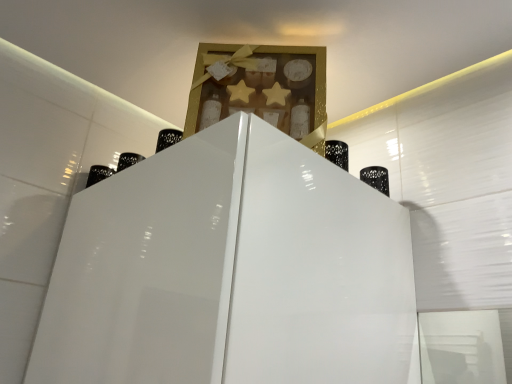
Image resolution: width=512 pixels, height=384 pixels. What do you see at coordinates (376, 178) in the screenshot? I see `black matte bottle at right` at bounding box center [376, 178].

This screenshot has width=512, height=384. Identify the location of black matte bottle at right. (376, 178).

The image size is (512, 384). Describe the element at coordinates (261, 88) in the screenshot. I see `gold textured box at upper center` at that location.

The image size is (512, 384). I want to click on gold textured box at upper center, so click(261, 88).

Image resolution: width=512 pixels, height=384 pixels. What are the coordinates of `black matte bottle at right` in the screenshot? It's located at (376, 178).

Considering the relative positions of gold textured box at upper center and black matte bottle at right in the image provided, is gold textured box at upper center to the left of black matte bottle at right from the viewer's perspective?

Indeed, gold textured box at upper center is positioned on the left side of black matte bottle at right.

Which object is further away from the camera, gold textured box at upper center or black matte bottle at right?

black matte bottle at right is more distant.

Does point (318, 53) come behind point (365, 177)?

No, it is in front of (365, 177).

From the image's perspective, who appears lower, gold textured box at upper center or black matte bottle at right?

black matte bottle at right, from the image's perspective.

From a real-world perspective, who is located higher, gold textured box at upper center or black matte bottle at right?

From a 3D spatial view, gold textured box at upper center is above.

Considering the sizes of objects gold textured box at upper center and black matte bottle at right in the image provided, who is wider, gold textured box at upper center or black matte bottle at right?

gold textured box at upper center is wider.

Based on the photo, is gold textured box at upper center shorter than black matte bottle at right?

No, gold textured box at upper center is not shorter than black matte bottle at right.

Who is smaller, gold textured box at upper center or black matte bottle at right?

Smaller between the two is black matte bottle at right.

From the picture: Is gold textured box at upper center completely or partially outside of black matte bottle at right?

Yes.

Is gold textured box at upper center with black matte bottle at right?

There is a gap between gold textured box at upper center and black matte bottle at right.

Does gold textured box at upper center turn towards black matte bottle at right?

No, gold textured box at upper center is not turned towards black matte bottle at right.

Can you tell me how much gold textured box at upper center and black matte bottle at right differ in facing direction?

gold textured box at upper center and black matte bottle at right are facing 46.6 degrees away from each other.

Locate an element on the screen. This screenshot has width=512, height=384. cabinet that appears above the black matte bottle at right (from a real-world perspective) is located at coordinates 261,88.

Is black matte bottle at right to the right of gold textured box at upper center from the viewer's perspective?

Correct, you'll find black matte bottle at right to the right of gold textured box at upper center.

Is black matte bottle at right closer to camera compared to gold textured box at upper center?

That is False.

Is point (380, 182) closer or farther from the camera than point (211, 47)?

Clearly, point (380, 182) is more distant from the camera than point (211, 47).

From the image's perspective, which is above, black matte bottle at right or gold textured box at upper center?

gold textured box at upper center appears higher in the image.

From a real-world perspective, is black matte bottle at right physically below gold textured box at upper center?

Yes, from a real-world perspective, black matte bottle at right is below gold textured box at upper center.

Is black matte bottle at right thinner than gold textured box at upper center?

Indeed, black matte bottle at right has a lesser width compared to gold textured box at upper center.

Between black matte bottle at right and gold textured box at upper center, which one has more height?

Standing taller between the two is gold textured box at upper center.

Is black matte bottle at right smaller than gold textured box at upper center?

Yes.

Do you think black matte bottle at right is within gold textured box at upper center, or outside of it?

black matte bottle at right is located beyond the bounds of gold textured box at upper center.

Would you say black matte bottle at right is a long distance from gold textured box at upper center?

They are positioned close to each other.

Is black matte bottle at right turned away from gold textured box at upper center?

No, black matte bottle at right's orientation is not away from gold textured box at upper center.

I want to click on cabinet that is in front of the black matte bottle at right, so click(261, 88).

This screenshot has width=512, height=384. In order to click on cabinet in front of the black matte bottle at right in this screenshot , I will do `click(261, 88)`.

The height and width of the screenshot is (384, 512). I want to click on bottle below the gold textured box at upper center (from the image's perspective), so click(x=376, y=178).